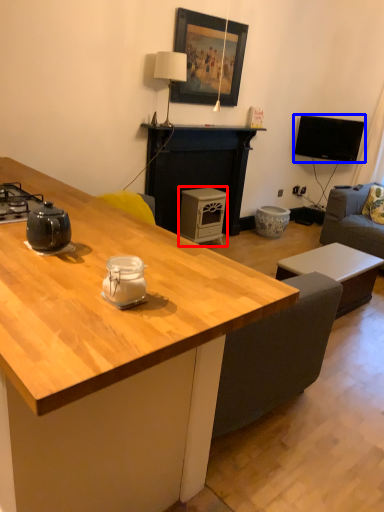
Question: Which of the following is the closest to the observer, appliance (highlighted by a red box) or television (highlighted by a blue box)?

Choices:
 (A) appliance
 (B) television

Answer: (A)